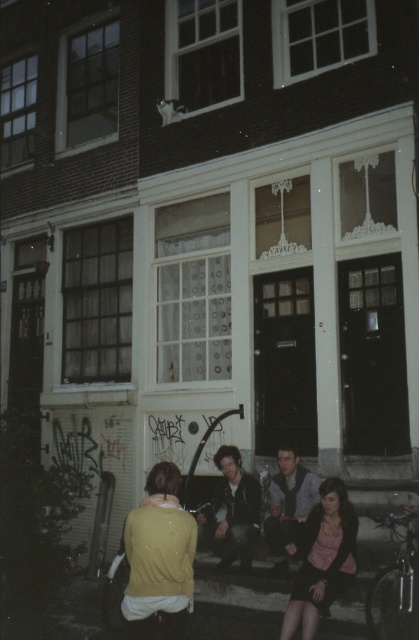
You are a photographer standing in front of the Dutch building. You have to decide whether the dark gray leather jacket at center can be fully framed in your camera viewfinder without cropping its edges, given that your camera can only capture objects up to the width of the gray textured vest at center. Can it fit?

The dark gray leather jacket at center might be wider than gray textured vest at center, so it may not fit within the camera viewfinder designed for the width of the gray textured vest at center. You might need to adjust your position or use a wider lens.

You are standing in front of the Dutch building and notice two people sitting on the steps. One is wearing a dark gray leather jacket at center and the other has a gray textured vest at center. Which clothing item is positioned lower on the person?

The dark gray leather jacket at center is located below the gray textured vest at center, so the dark gray leather jacket at center is positioned lower on the person.